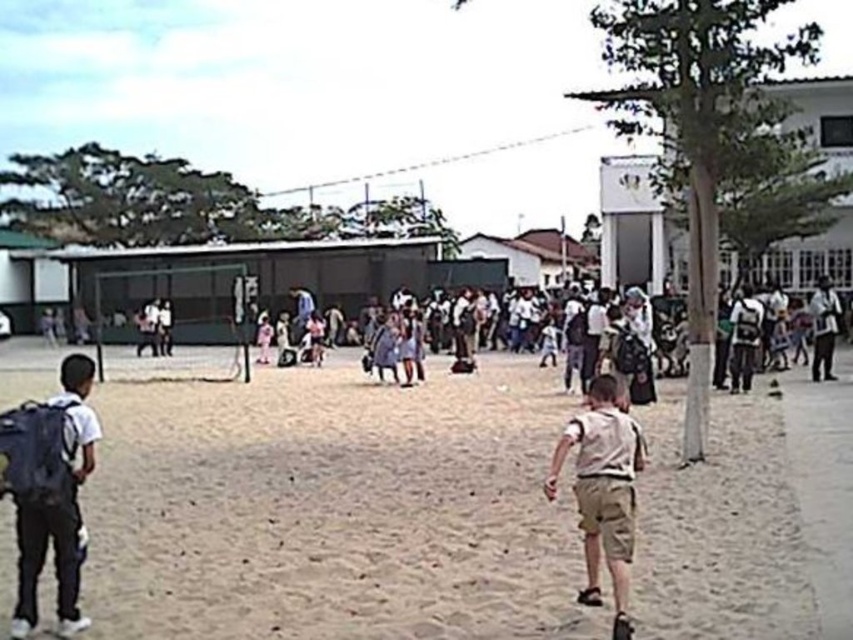
Question: Which point is farther to the camera?

Choices:
 (A) khaki shorts at center
 (B) brown sandy dirt field at center
 (C) black fabric backpack at left

Answer: (C)

Question: Which of the following is the farthest from the observer?

Choices:
 (A) brown sandy dirt field at center
 (B) black fabric backpack at left

Answer: (B)

Question: Which point appears closest to the camera in this image?

Choices:
 (A) (86, 390)
 (B) (618, 458)

Answer: (B)

Question: Can you confirm if black fabric backpack at left is positioned to the left of khaki shorts at center?

Choices:
 (A) no
 (B) yes

Answer: (B)

Question: Is the position of black fabric backpack at left less distant than that of khaki shorts at center?

Choices:
 (A) no
 (B) yes

Answer: (A)

Question: Is the position of brown sandy dirt field at center more distant than that of black fabric backpack at left?

Choices:
 (A) no
 (B) yes

Answer: (A)